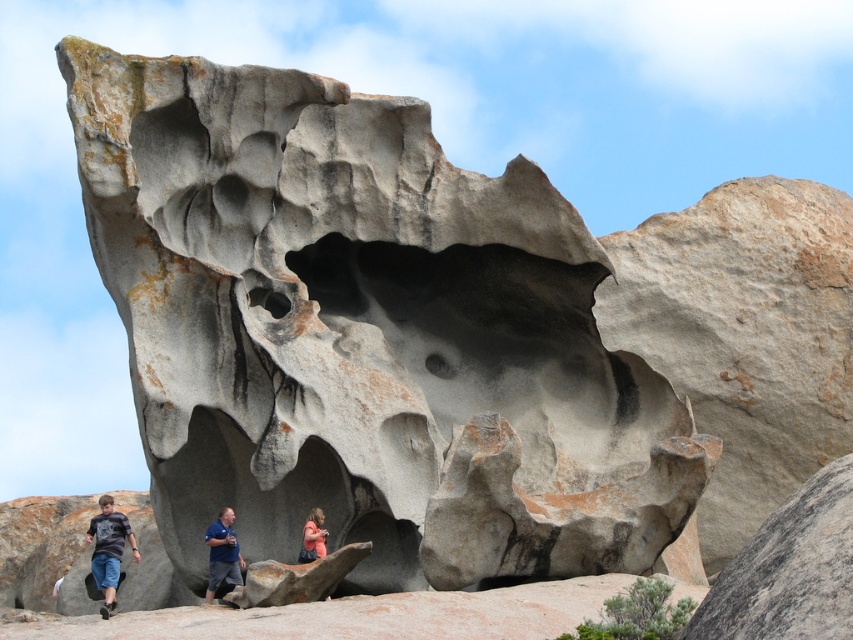
Which is below, gray rough rock at center or pink fabric at center?

pink fabric at center is below.

Which is in front, point (558, 566) or point (315, 531)?

Point (558, 566) is more forward.

Who is more forward, (370, 588) or (305, 529)?

Point (305, 529) is more forward.

At what (x,y) coordinates should I click in order to perform the action: click on gray rough rock at center. Please return your answer as a coordinate pair (x, y). Looking at the image, I should click on point(366,333).

Is dark gray t-shirt at lower left to the right of blue denim jeans at center from the viewer's perspective?

Incorrect, dark gray t-shirt at lower left is not on the right side of blue denim jeans at center.

Consider the image. Is dark gray t-shirt at lower left closer to camera compared to blue denim jeans at center?

That is True.

Is point (126, 538) less distant than point (228, 540)?

That is False.

Identify the location of dark gray t-shirt at lower left. tap(108, 550).

Does point (595, 401) come closer to viewer compared to point (207, 541)?

No, (595, 401) is behind (207, 541).

Can you confirm if gray rough rock at center is thinner than blue denim jeans at center?

No.

The image size is (853, 640). Describe the element at coordinates (366, 333) in the screenshot. I see `gray rough rock at center` at that location.

This screenshot has width=853, height=640. Identify the location of gray rough rock at center. (366, 333).